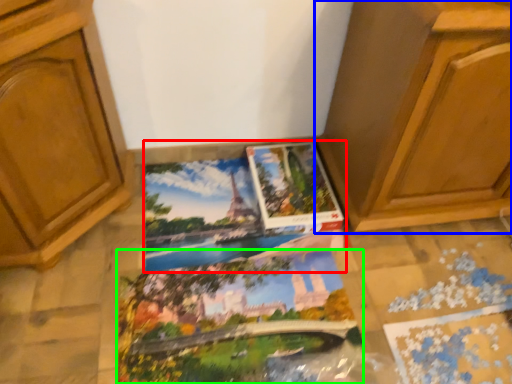
Question: Estimate the real-world distances between objects in this image. Which object is closer to coloring book (highlighted by a red box), cabinetry (highlighted by a blue box) or coloring book (highlighted by a green box)?

Choices:
 (A) cabinetry
 (B) coloring book

Answer: (B)